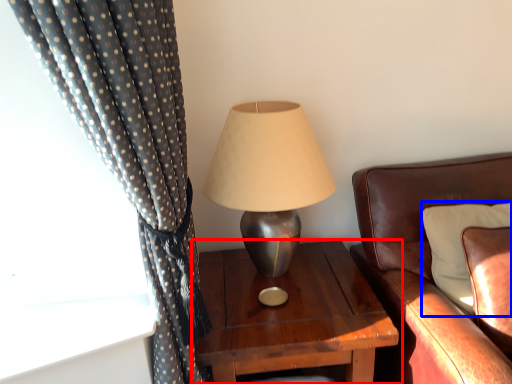
Question: Among these objects, which one is farthest to the camera, nightstand (highlighted by a red box) or pillow (highlighted by a blue box)?

Choices:
 (A) nightstand
 (B) pillow

Answer: (A)